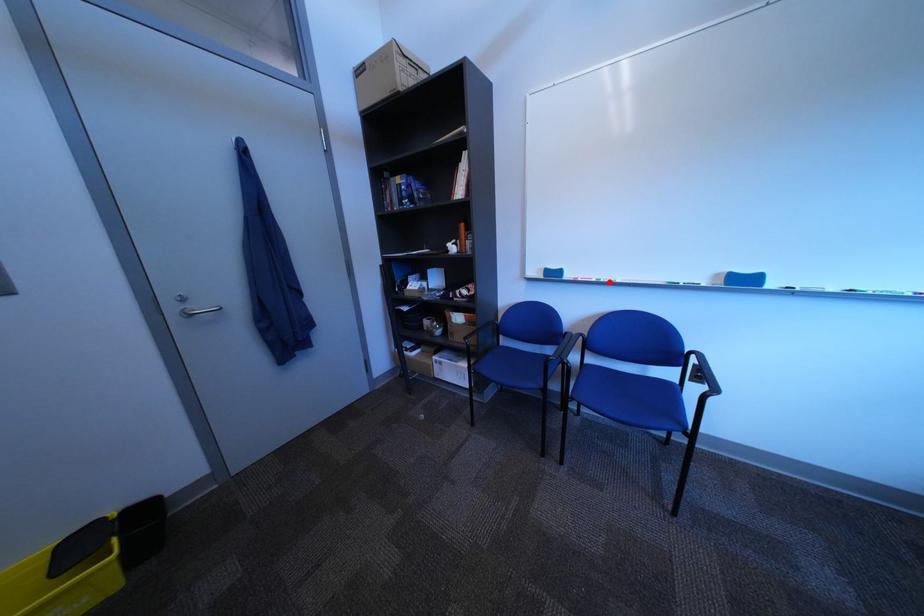
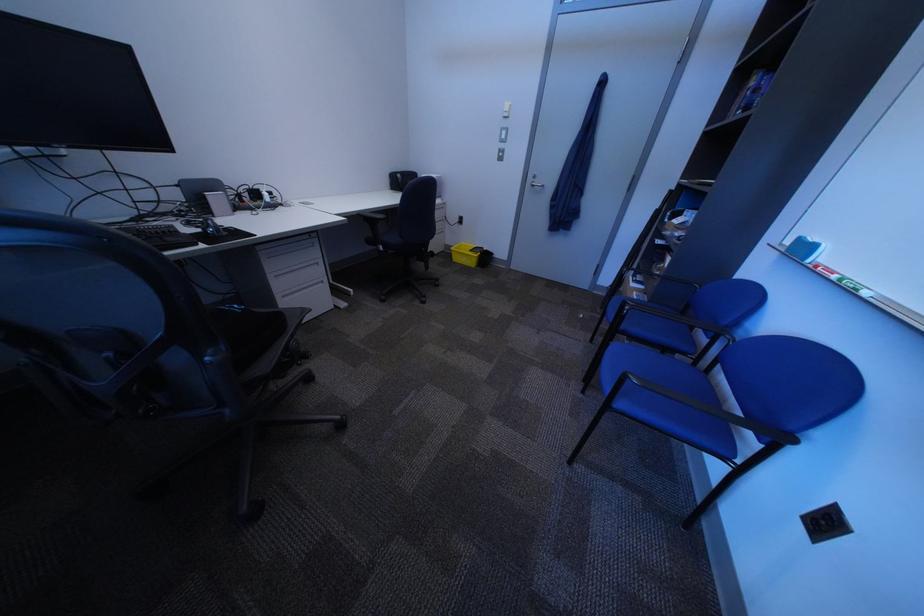
Find the pixel in the second image that matches the highlighted location in the first image.

(849, 278)